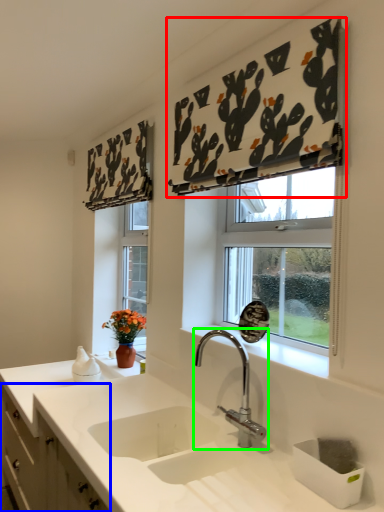
Question: Which is nearer to the curtain (highlighted by a red box)? cabinetry (highlighted by a blue box) or tap (highlighted by a green box).

Choices:
 (A) cabinetry
 (B) tap

Answer: (B)